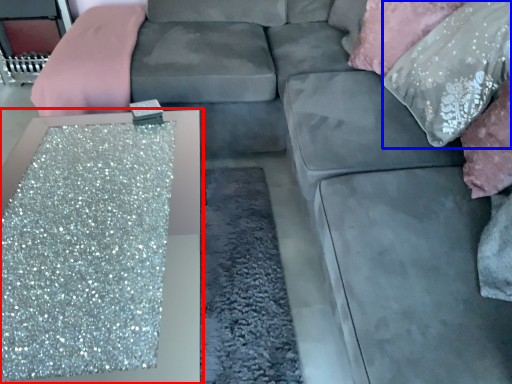
Question: Which of the following is the closest to the observer, table (highlighted by a red box) or pillow (highlighted by a blue box)?

Choices:
 (A) table
 (B) pillow

Answer: (A)